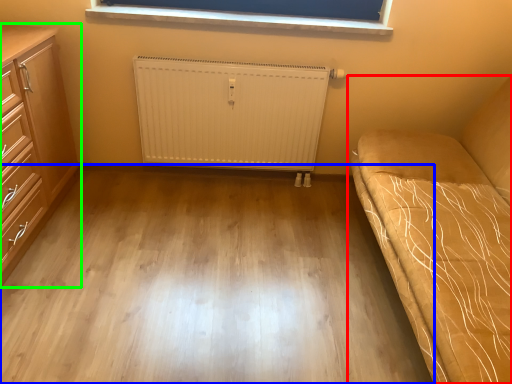
Question: Which object is the closest to the studio couch (highlighted by a red box)? Choose among these: plain (highlighted by a blue box) or chest of drawers (highlighted by a green box).

Choices:
 (A) plain
 (B) chest of drawers

Answer: (A)